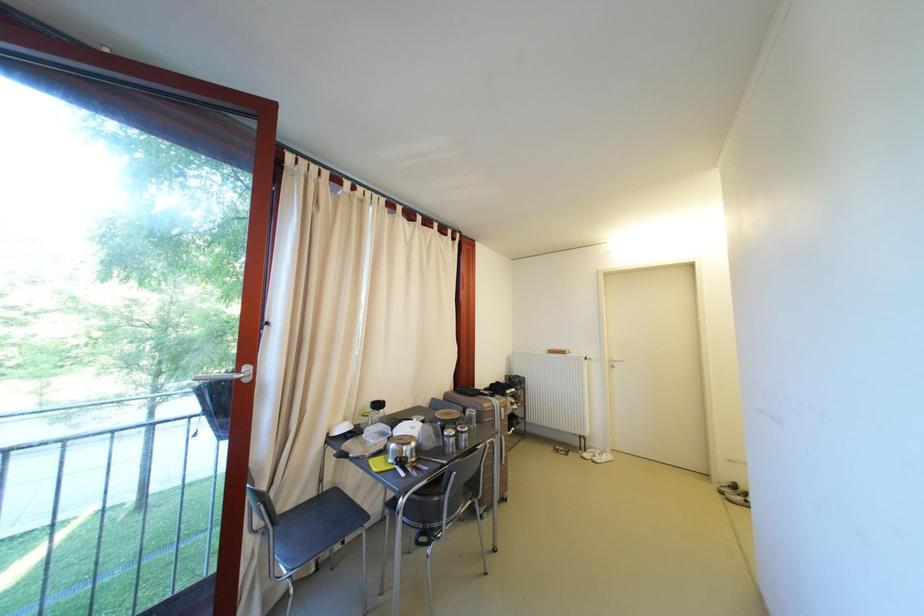
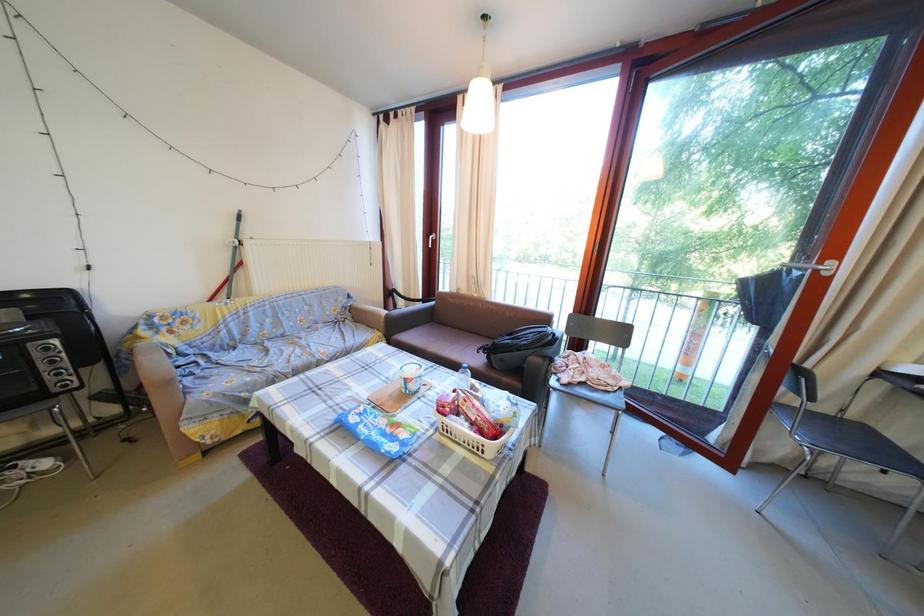
Based on the continuous images, in which direction is the camera rotating?

The rotation direction of the camera is left-down.